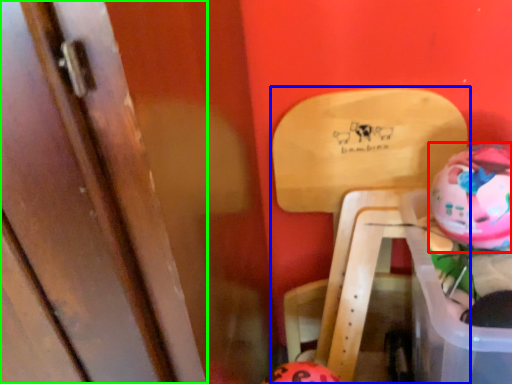
Question: Based on their relative distances, which object is nearer to piggy bank (highlighted by a red box)? Choose from furniture (highlighted by a blue box) and door (highlighted by a green box).

Choices:
 (A) furniture
 (B) door

Answer: (A)